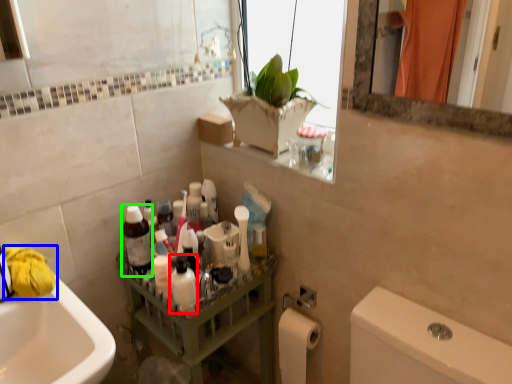
Question: Considering the real-world distances, which object is farthest from mouthwash (highlighted by a red box)? material (highlighted by a blue box) or bottle (highlighted by a green box)?

Choices:
 (A) material
 (B) bottle

Answer: (A)